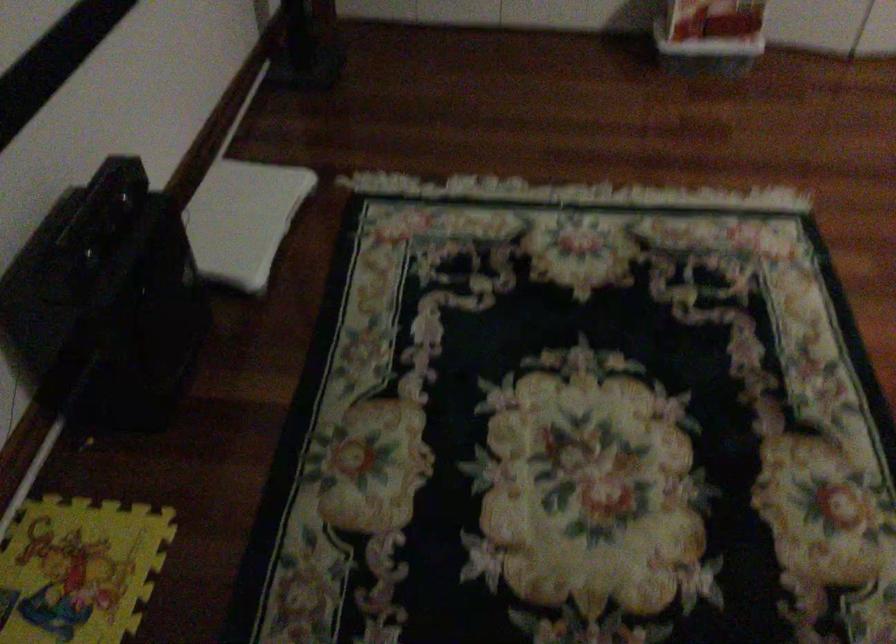
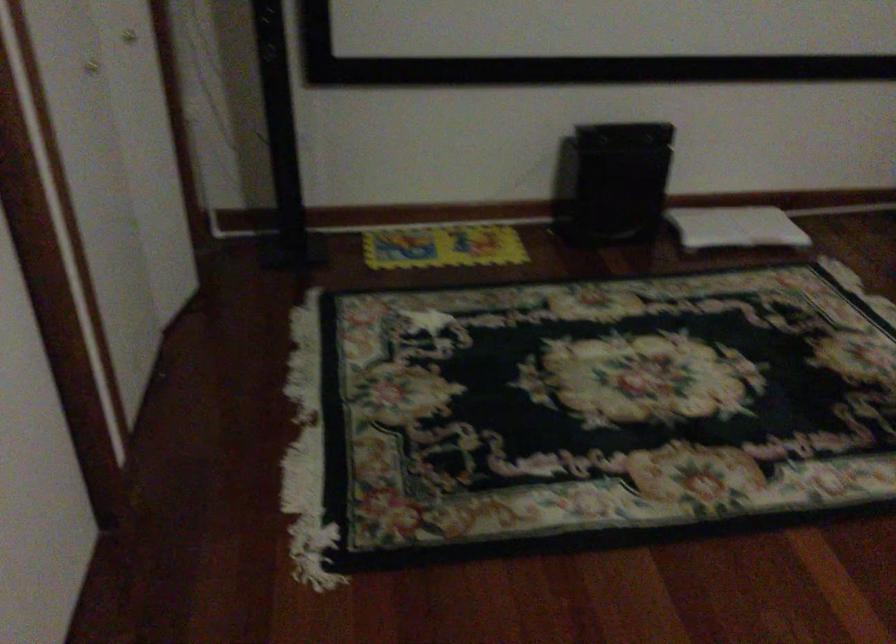
Locate, in the second image, the point that corresponds to the point at 254,241 in the first image.

(735, 227)